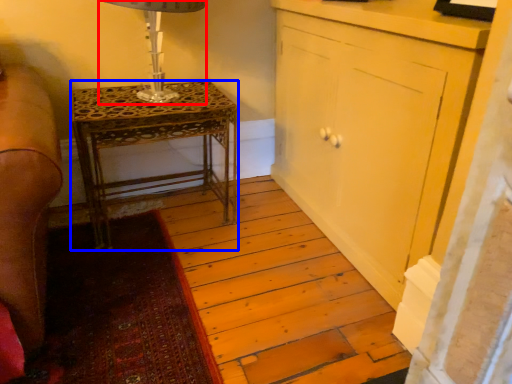
Question: Which of the following is the closest to the observer, table lamp (highlighted by a red box) or nightstand (highlighted by a blue box)?

Choices:
 (A) table lamp
 (B) nightstand

Answer: (A)